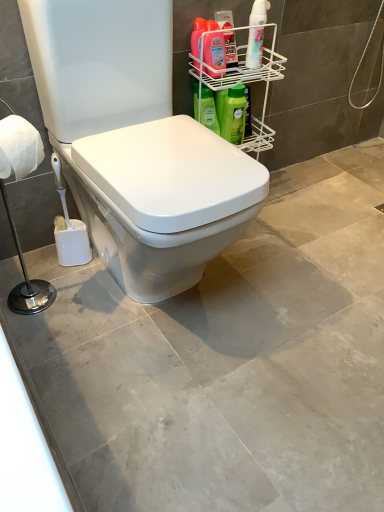
Question: Would you consider white glossy spray bottle at upper right, acting as the fifth cleaning product starting from the left, to be distant from matte pink bottle at upper right, the 4th cleaning product from the right?

Choices:
 (A) yes
 (B) no

Answer: (B)

Question: Does white glossy spray bottle at upper right, acting as the fifth cleaning product starting from the left, appear on the right side of matte pink bottle at upper right, the 4th cleaning product from the right?

Choices:
 (A) yes
 (B) no

Answer: (A)

Question: Is white glossy spray bottle at upper right, acting as the fifth cleaning product starting from the left, closer to the viewer compared to matte pink bottle at upper right, positioned as the 2th cleaning product in left-to-right order?

Choices:
 (A) yes
 (B) no

Answer: (B)

Question: Is white glossy spray bottle at upper right, the first cleaning product positioned from the right, completely or partially outside of matte pink bottle at upper right, positioned as the 2th cleaning product in left-to-right order?

Choices:
 (A) no
 (B) yes

Answer: (B)

Question: Is white glossy spray bottle at upper right, acting as the fifth cleaning product starting from the left, next to matte pink bottle at upper right, the 4th cleaning product from the right, and touching it?

Choices:
 (A) yes
 (B) no

Answer: (B)

Question: From the image's perspective, is green matte bottle at upper right, the 5th cleaning product when ordered from right to left, positioned above or below matte pink bottle at upper right, the 3th cleaning product positioned from the right?

Choices:
 (A) above
 (B) below

Answer: (B)

Question: In terms of width, does green matte bottle at upper right, the first cleaning product positioned from the left, look wider or thinner when compared to matte pink bottle at upper right, the 3th cleaning product positioned from the right?

Choices:
 (A) thin
 (B) wide

Answer: (B)

Question: Based on their positions, is green matte bottle at upper right, the first cleaning product positioned from the left, located to the left or right of matte pink bottle at upper right, which is the 3th cleaning product from left to right?

Choices:
 (A) left
 (B) right

Answer: (A)

Question: Is point (208, 93) positioned closer to the camera than point (226, 19)?

Choices:
 (A) closer
 (B) farther

Answer: (B)

Question: Is matte pink bottle at upper right, the 4th cleaning product from the right, inside or outside of matte pink bottle at upper right, which is the 3th cleaning product from left to right?

Choices:
 (A) outside
 (B) inside

Answer: (A)

Question: Is matte pink bottle at upper right, the 4th cleaning product from the right, wider or thinner than matte pink bottle at upper right, the 3th cleaning product positioned from the right?

Choices:
 (A) wide
 (B) thin

Answer: (B)

Question: Based on their sizes in the image, would you say matte pink bottle at upper right, positioned as the 2th cleaning product in left-to-right order, is bigger or smaller than matte pink bottle at upper right, the 3th cleaning product positioned from the right?

Choices:
 (A) big
 (B) small

Answer: (A)

Question: In the image, is matte pink bottle at upper right, the 4th cleaning product from the right, positioned in front of or behind matte pink bottle at upper right, the 3th cleaning product positioned from the right?

Choices:
 (A) front
 (B) behind

Answer: (A)

Question: Considering the positions of white matte toilet paper at left and white wire rack at upper right in the image, is white matte toilet paper at left taller or shorter than white wire rack at upper right?

Choices:
 (A) tall
 (B) short

Answer: (B)

Question: Looking at the image, does white matte toilet paper at left seem bigger or smaller compared to white wire rack at upper right?

Choices:
 (A) big
 (B) small

Answer: (B)